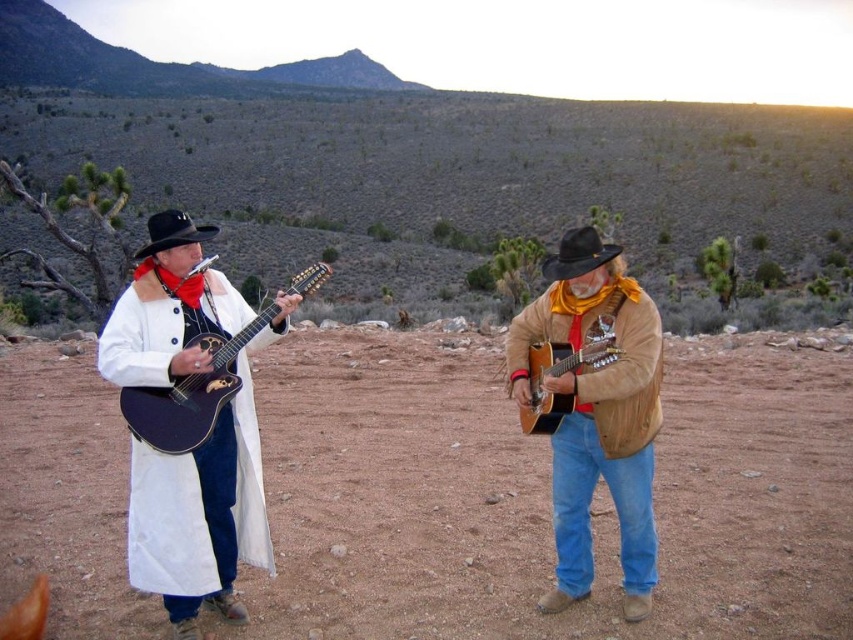
Does matte black guitar at left have a larger size compared to suede jacket at center?

Correct, matte black guitar at left is larger in size than suede jacket at center.

The image size is (853, 640). I want to click on matte black guitar at left, so click(x=200, y=515).

The height and width of the screenshot is (640, 853). Describe the element at coordinates (200, 515) in the screenshot. I see `matte black guitar at left` at that location.

This screenshot has width=853, height=640. I want to click on matte black guitar at left, so click(x=200, y=515).

Does acoustic wood guitar at center lie in front of black felt cowboy hat at center?

Yes, acoustic wood guitar at center is closer to the viewer.

Between acoustic wood guitar at center and black felt cowboy hat at center, which one appears on the left side from the viewer's perspective?

acoustic wood guitar at center

Is point (546, 358) farther from viewer compared to point (550, 269)?

Yes, it is behind point (550, 269).

You are a GUI agent. You are given a task and a screenshot of the screen. Output one action in this format:
    pyautogui.click(x=<x>, y=<y>)
    Task: Click on the acoustic wood guitar at center
    The height and width of the screenshot is (640, 853).
    Given the screenshot: What is the action you would take?
    pyautogui.click(x=558, y=376)

Does brown dirt field at center lie in front of matte black guitar at left?

No.

Can you confirm if brown dirt field at center is thinner than matte black guitar at left?

Incorrect, brown dirt field at center's width is not less than matte black guitar at left's.

Which is in front, point (521, 458) or point (132, 538)?

Point (132, 538)

This screenshot has width=853, height=640. I want to click on brown dirt field at center, so click(x=544, y=497).